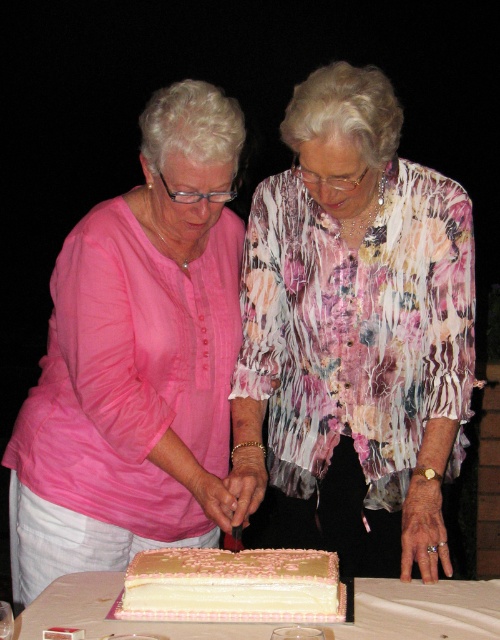
Is pink fabric shirt at left positioned before white glossy cake at center?

No, pink fabric shirt at left is behind white glossy cake at center.

Does pink fabric shirt at left have a greater height compared to white glossy cake at center?

Yes.

Does point (57, 509) lie in front of point (438, 595)?

No, it is behind (438, 595).

Identify the location of pink fabric shirt at left. This screenshot has width=500, height=640. (137, 358).

Between white glossy cake at center and white cream cake at center, which one has more height?

Standing taller between the two is white cream cake at center.

At what (x,y) coordinates should I click in order to perform the action: click on white glossy cake at center. Please return your answer as a coordinate pair (x, y). The width and height of the screenshot is (500, 640). Looking at the image, I should click on (422, 611).

Is point (384, 586) positioned after point (332, 588)?

Yes, point (384, 586) is farther from viewer.

Find the location of a particular element. white glossy cake at center is located at coordinates (422, 611).

Can you confirm if pink fabric shirt at left is positioned below white cream cake at center?

No, pink fabric shirt at left is not below white cream cake at center.

Between pink fabric shirt at left and white cream cake at center, which one appears on the left side from the viewer's perspective?

From the viewer's perspective, pink fabric shirt at left appears more on the left side.

Who is more forward, (173, 516) or (184, 566)?

Positioned in front is point (184, 566).

I want to click on pink fabric shirt at left, so [x=137, y=358].